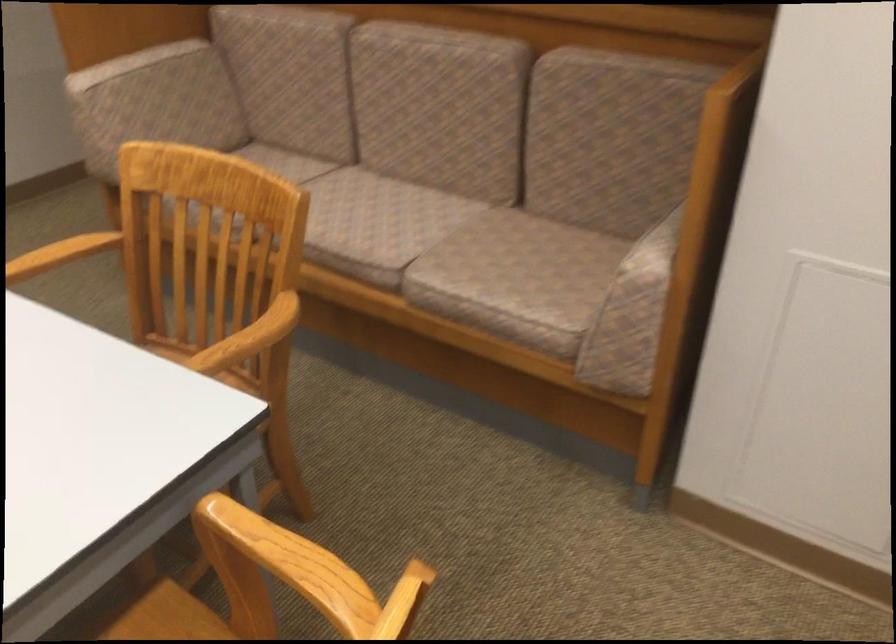
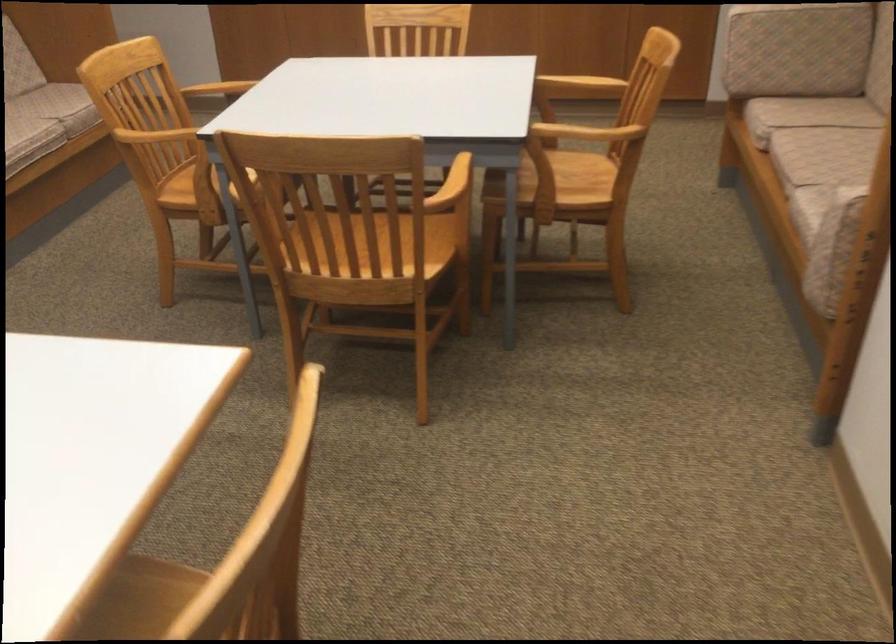
Where in the second image is the point corresponding to (302,540) from the first image?

(470, 174)